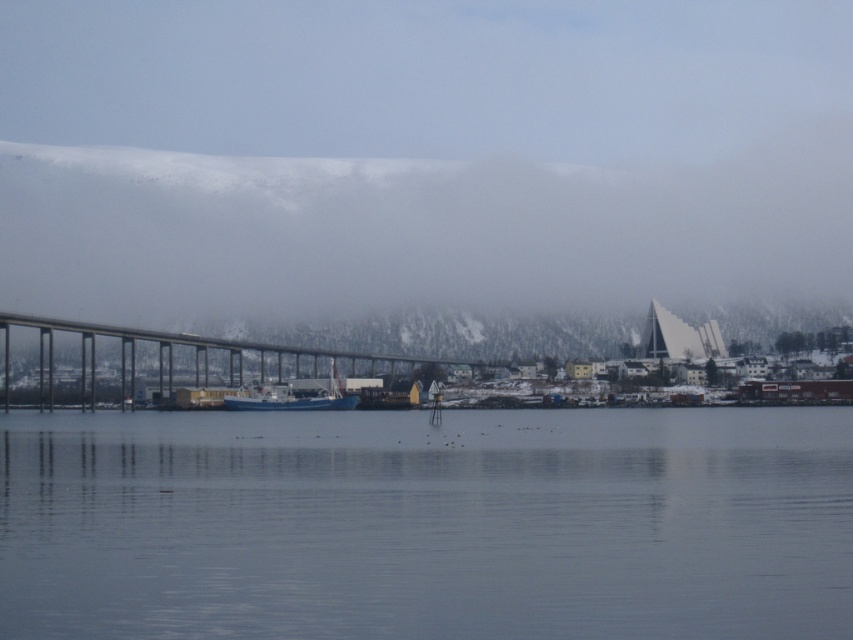
You are standing on the shore looking at the scene. You see the transparent water at center and the metallic gray bridge at center. Which object is positioned to the right side?

The transparent water at center is to the right of the metallic gray bridge at center.

You are a photographer planning to take a photo of the transparent water at center and the blue matte boat at center from a position where both are visible. Given that your camera has a maximum focal length that allows capturing objects up to 100 meters apart in the same frame, will you be able to include both in a single shot?

The transparent water at center and blue matte boat at center are 110.91 meters apart, which exceeds the camera maximum focal length of 100 meters. Therefore, you cannot include both in a single shot.